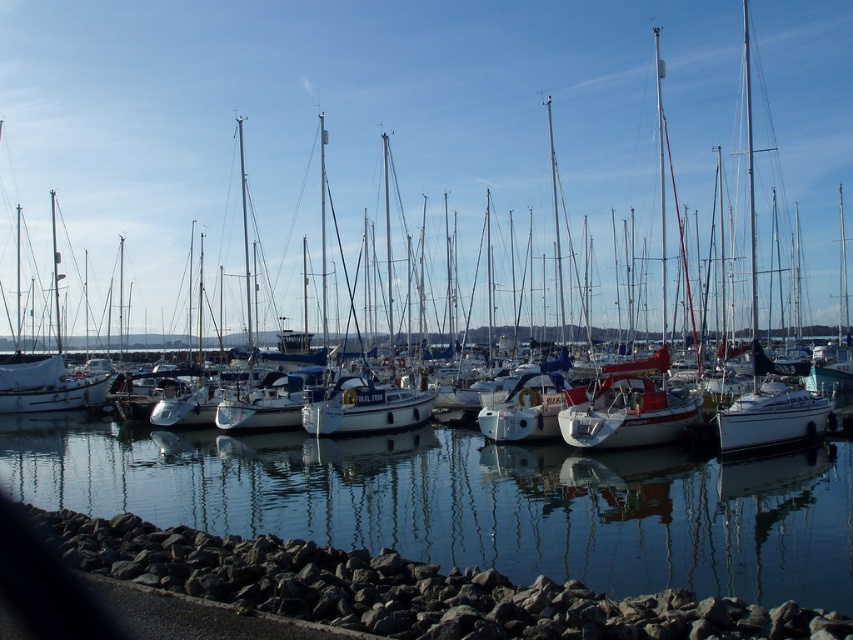
Does white glossy sailboat at center have a greater height compared to white glossy boat at center?

Yes, white glossy sailboat at center is taller than white glossy boat at center.

Where is `white glossy sailboat at center`? white glossy sailboat at center is located at coordinates click(347, 120).

Identify the location of white glossy sailboat at center. This screenshot has width=853, height=640. (347, 120).

How distant is white glossy sailboat at center from clear water at center?

white glossy sailboat at center is 103.46 meters from clear water at center.

Is white glossy sailboat at center smaller than clear water at center?

No, white glossy sailboat at center is not smaller than clear water at center.

Is point (41, 22) closer to viewer compared to point (270, 467)?

That is False.

Find the location of `white glossy sailboat at center`. white glossy sailboat at center is located at coordinates (347, 120).

Looking at this image, who is shorter, clear water at center or white glossy boat at center?

Standing shorter between the two is clear water at center.

Between clear water at center and white glossy boat at center, which one is positioned lower?

clear water at center is lower down.

Which is behind, point (305, 529) or point (352, 413)?

The point (352, 413) is behind.

Where is `clear water at center`? clear water at center is located at coordinates (471, 500).